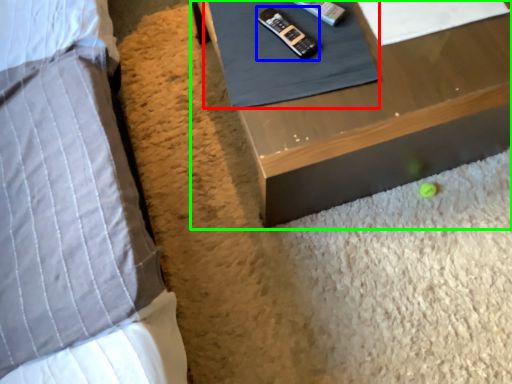
Question: Considering the real-world distances, which object is closest to sheet (highlighted by a red box)? control (highlighted by a blue box) or table (highlighted by a green box).

Choices:
 (A) control
 (B) table

Answer: (A)